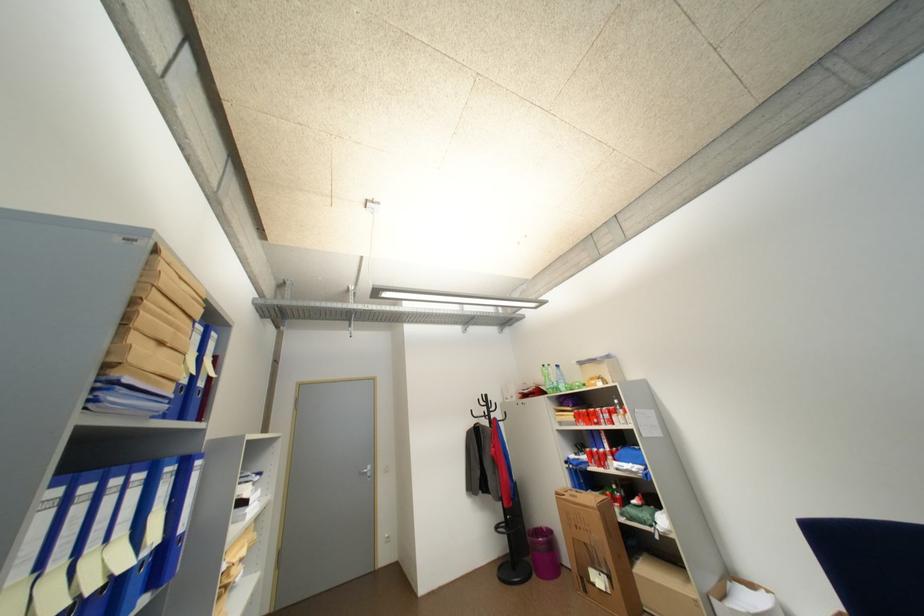
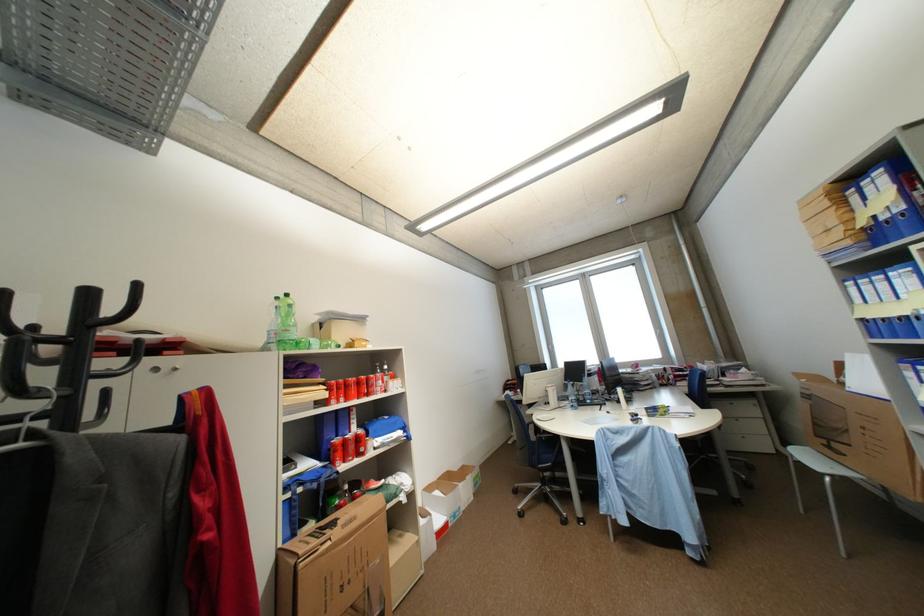
In the second image, find the point that corresponds to [611,461] in the first image.

(368, 447)